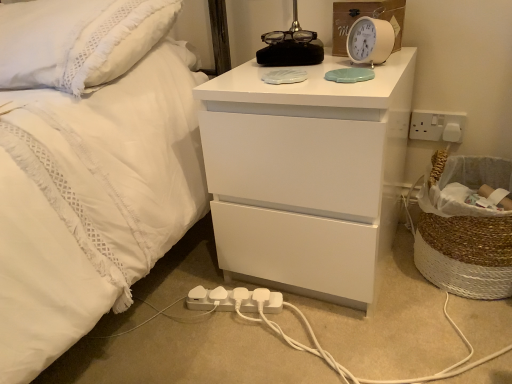
Question: Is braided straw laundry basket at right taller than white plastic alarm clock at upper right?

Choices:
 (A) yes
 (B) no

Answer: (A)

Question: From a real-world perspective, does braided straw laundry basket at right sit lower than white plastic alarm clock at upper right?

Choices:
 (A) no
 (B) yes

Answer: (B)

Question: Is braided straw laundry basket at right outside white plastic alarm clock at upper right?

Choices:
 (A) no
 (B) yes

Answer: (B)

Question: Is braided straw laundry basket at right positioned with its back to white plastic alarm clock at upper right?

Choices:
 (A) no
 (B) yes

Answer: (A)

Question: Is braided straw laundry basket at right next to white plastic alarm clock at upper right and touching it?

Choices:
 (A) yes
 (B) no

Answer: (B)

Question: Are braided straw laundry basket at right and white plastic alarm clock at upper right located far from each other?

Choices:
 (A) yes
 (B) no

Answer: (B)

Question: From a real-world perspective, is white plastic electric outlet at right on white plastic extension cord at lower center?

Choices:
 (A) no
 (B) yes

Answer: (B)

Question: Is the depth of white plastic electric outlet at right less than that of white plastic extension cord at lower center?

Choices:
 (A) no
 (B) yes

Answer: (A)

Question: Does white plastic electric outlet at right appear on the left side of white plastic extension cord at lower center?

Choices:
 (A) no
 (B) yes

Answer: (A)

Question: Does white plastic electric outlet at right turn towards white plastic extension cord at lower center?

Choices:
 (A) no
 (B) yes

Answer: (A)

Question: Is white plastic electric outlet at right with white plastic extension cord at lower center?

Choices:
 (A) no
 (B) yes

Answer: (A)

Question: Is white plastic electric outlet at right further to camera compared to white plastic extension cord at lower center?

Choices:
 (A) no
 (B) yes

Answer: (B)

Question: Is white plastic extension cord at lower center not near white glossy chest of drawers at upper center?

Choices:
 (A) no
 (B) yes

Answer: (A)